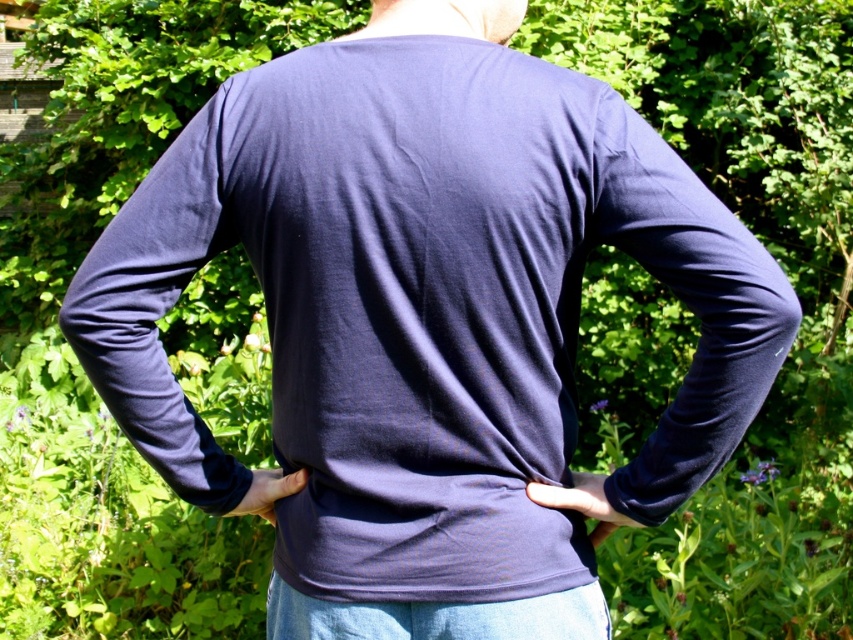
Consider the image. Does matte black hand at center come in front of matte blue fabric at center?

Yes, it is.

From the picture: Which is below, matte black hand at center or matte blue fabric at center?

matte blue fabric at center

Does point (599, 513) come behind point (270, 486)?

No, it is in front of (270, 486).

Locate an element on the screen. This screenshot has height=640, width=853. matte black hand at center is located at coordinates (582, 502).

Looking at this image, can you confirm if navy blue fabric at center is bigger than matte black hand at center?

Yes.

Who is higher up, navy blue fabric at center or matte black hand at center?

Positioned higher is matte black hand at center.

Where is `navy blue fabric at center`? Image resolution: width=853 pixels, height=640 pixels. navy blue fabric at center is located at coordinates (427, 531).

Which is below, navy blue fabric at center or matte blue fabric at center?

navy blue fabric at center is lower down.

Who is shorter, navy blue fabric at center or matte blue fabric at center?

matte blue fabric at center

Is point (283, 552) behind point (288, 483)?

No, (283, 552) is closer to viewer.

The width and height of the screenshot is (853, 640). I want to click on navy blue fabric at center, so click(x=427, y=531).